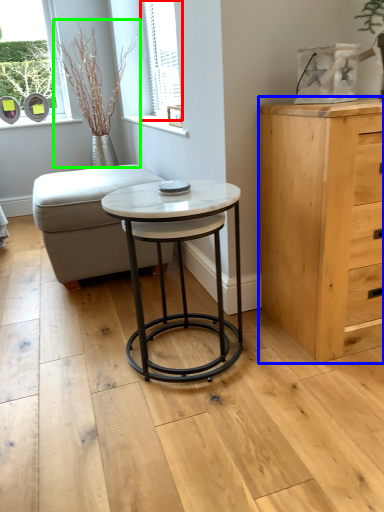
Question: Considering the real-world distances, which object is closest to window (highlighted by a red box)? chest of drawers (highlighted by a blue box) or plant (highlighted by a green box).

Choices:
 (A) chest of drawers
 (B) plant

Answer: (B)